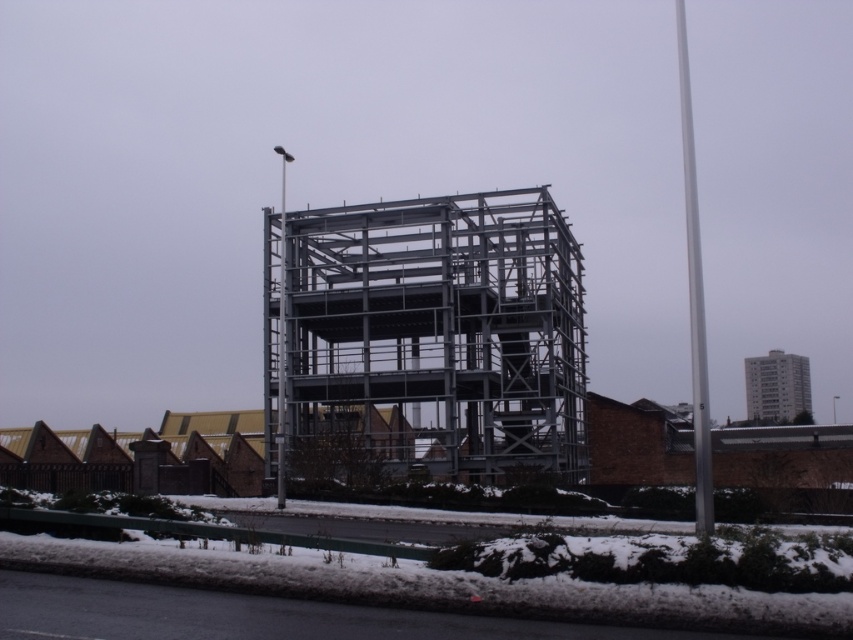
Question: Which is farther from the silver metallic pole at right?

Choices:
 (A) metallic gray pole at center
 (B) gray concrete building at upper right

Answer: (A)

Question: Can you confirm if silver metallic pole at right is thinner than gray concrete building at upper right?

Choices:
 (A) no
 (B) yes

Answer: (A)

Question: Estimate the real-world distances between objects in this image. Which object is farther from the metallic gray pole at center?

Choices:
 (A) metallic structure at center
 (B) silver metallic pole at right
 (C) gray concrete building at upper right

Answer: (C)

Question: Which of these objects is positioned closest to the metallic gray pole at center?

Choices:
 (A) silver metallic pole at right
 (B) gray concrete building at upper right
 (C) metallic structure at center

Answer: (C)

Question: Is silver metallic pole at right positioned at the back of metallic gray pole at center?

Choices:
 (A) yes
 (B) no

Answer: (B)

Question: Where is metallic structure at center located in relation to silver metallic pole at right in the image?

Choices:
 (A) right
 (B) left

Answer: (B)